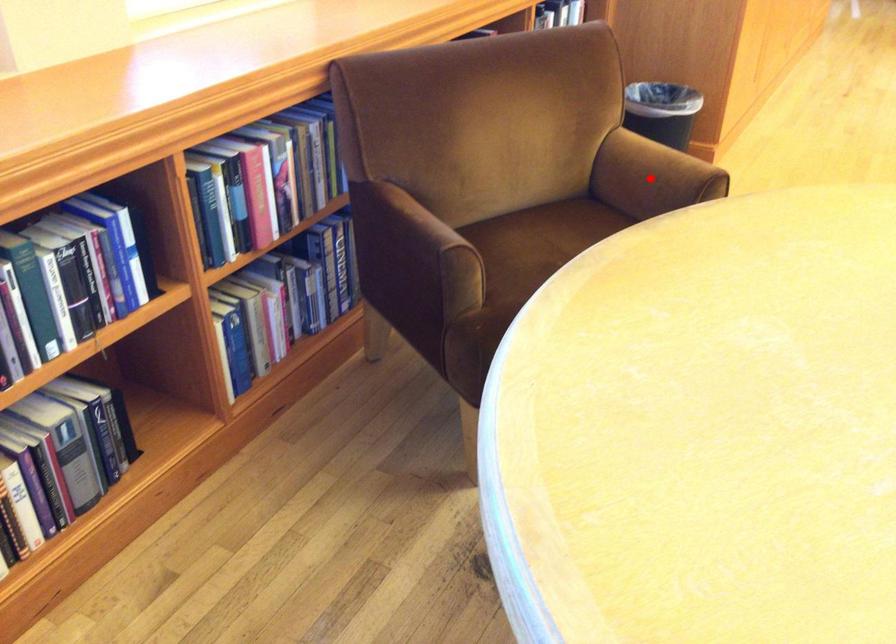
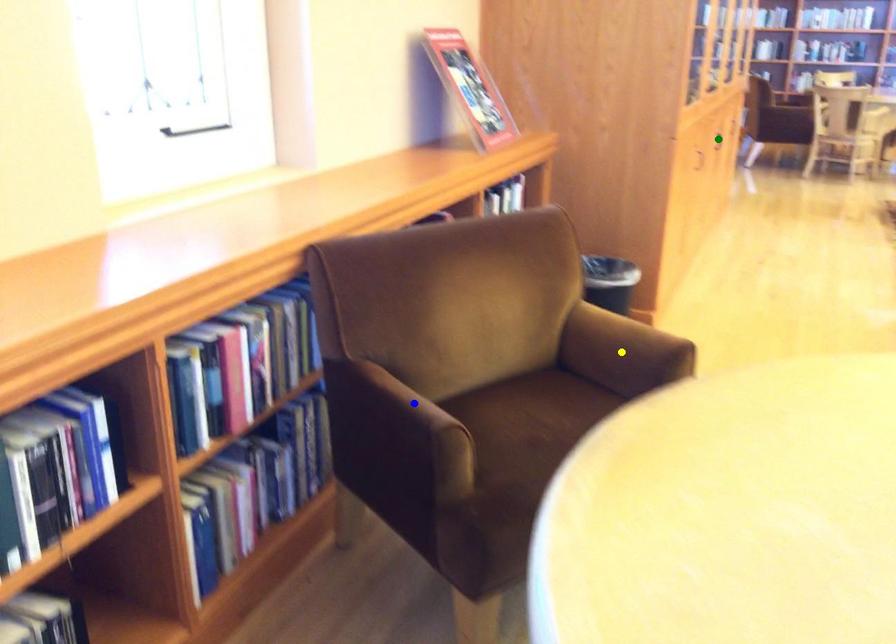
Question: I am providing you with two images of the same scene from different viewpoints. A red point is marked on the first image. You are given multiple points on the second image. Which spot in image 2 lines up with the point in image 1?

Choices:
 (A) yellow point
 (B) blue point
 (C) green point

Answer: (A)